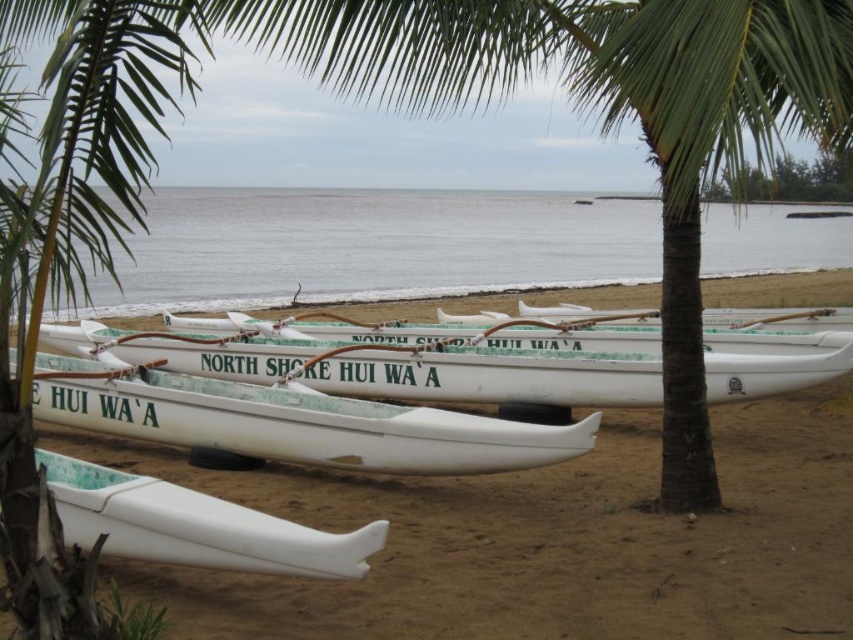
In the scene shown: You are a photographer standing on the beach and want to capture both the clear water at center and the white glossy canoe at lower left in a single shot. Which object will appear larger in the photo?

The clear water at center will appear larger in the photo because it is much taller than the white glossy canoe at lower left.

You are a photographer setting up a tripod on the beach. You want to capture both the white translucent canoe at center and the white glossy canoe at lower left in your shot. Which canoe should you position closer to the left edge of your camera frame to ensure both are visible?

You should position the white glossy canoe at lower left closer to the left edge of your camera frame because the white translucent canoe at center is on its right side, so placing the glossy canoe left will keep both within the frame.

You are a beach maintenance worker who needs to store the white plastic canoe at center and the white translucent canoe at center in a storage shed. The shed has two storage bays with widths of 1.5 meters and 1.2 meters respectively. Which canoe should be placed in which bay to ensure proper fitting?

The white plastic canoe at center is wider than the white translucent canoe at center. Therefore, the white plastic canoe at center should be placed in the 1.5 meters bay, and the white translucent canoe at center should be placed in the 1.2 meters bay to ensure proper fitting.